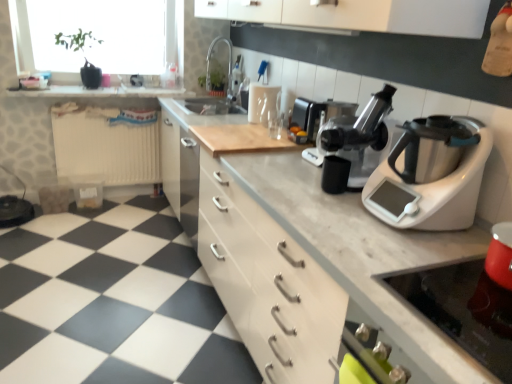
You are a GUI agent. You are given a task and a screenshot of the screen. Output one action in this format:
    pyautogui.click(x=<x>, y=<y>)
    Task: Click on the vacant space in white plastic radiator at lower left (from a real-world perspective)
    
    Given the screenshot: What is the action you would take?
    pyautogui.click(x=124, y=193)